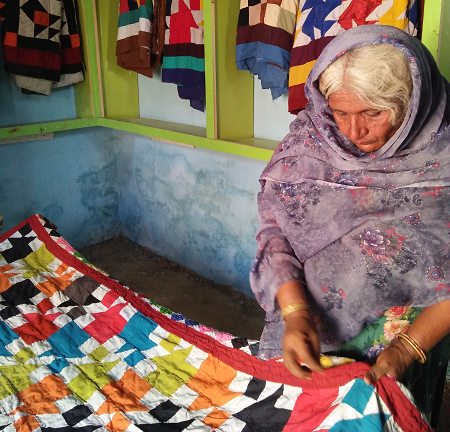
The height and width of the screenshot is (432, 450). I want to click on red border on quilt, so click(262, 361).